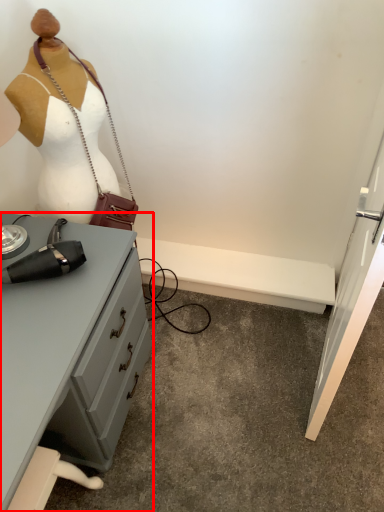
Question: From the image's perspective, where is desk (annotated by the red box) located relative to accessory?

Choices:
 (A) above
 (B) below

Answer: (B)